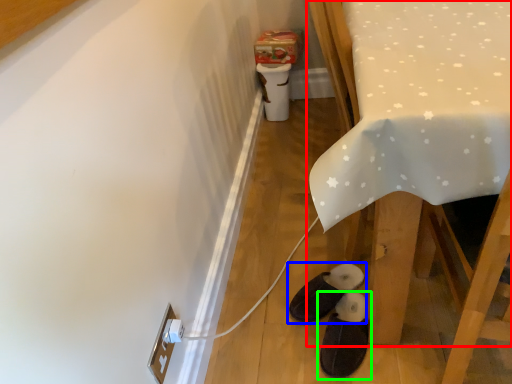
Question: Which is nearer to the furniture (highlighted by a red box)? footwear (highlighted by a blue box) or footwear (highlighted by a green box).

Choices:
 (A) footwear
 (B) footwear

Answer: (B)